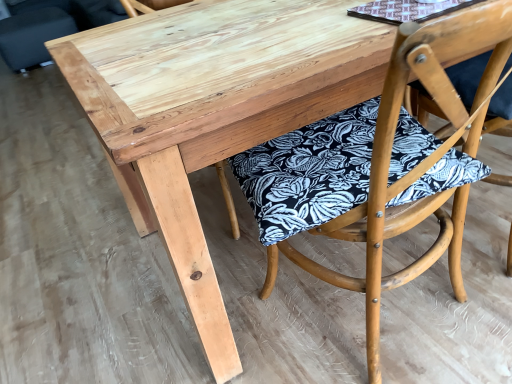
Find the location of a particular element. This screenshot has width=512, height=384. vacant space underneath wooden chair with floral cushion at lower right (from a real-world perspective) is located at coordinates (408, 326).